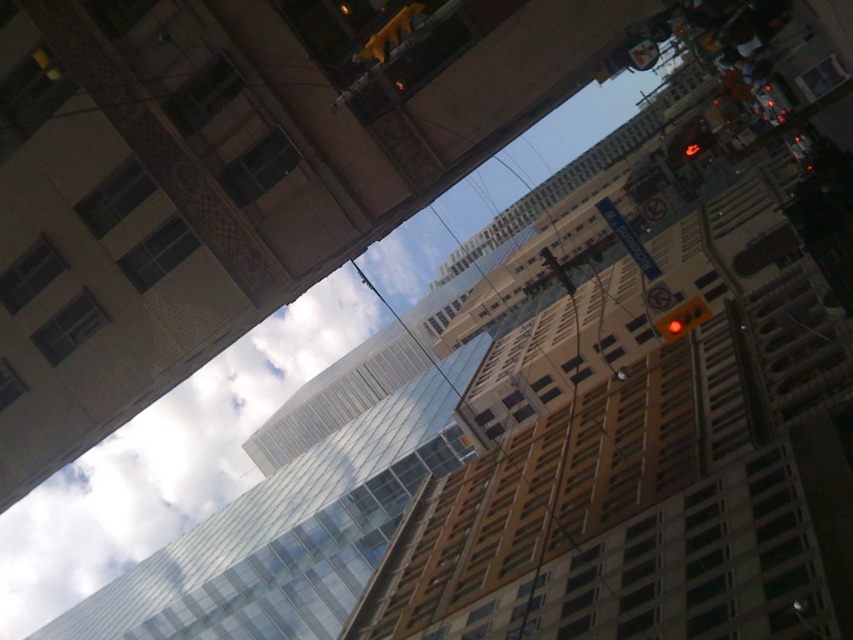
You are standing on the sidewalk looking up at the buildings. Where is the yellow matte traffic light at upper center located in relation to the buildings?

The yellow matte traffic light at upper center is located at the upper part of the scene, near the center, above the buildings.

You are standing on the street looking up at the buildings. You notice a white translucent cloud at upper center and a yellow matte traffic light at upper center. Which object is closer to your eyes?

The white translucent cloud at upper center is closer to your eyes than the yellow matte traffic light at upper center.